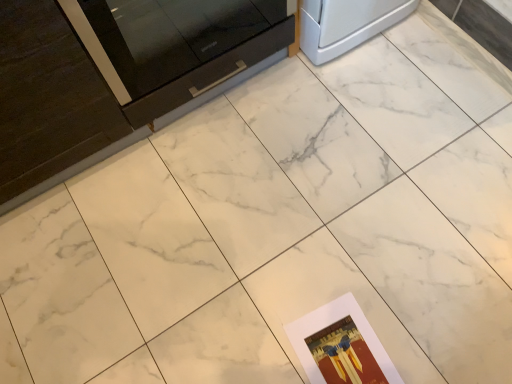
Locate an element on the screen. matte paper postcard at lower right is located at coordinates (341, 346).

The image size is (512, 384). What do you see at coordinates (341, 346) in the screenshot?
I see `matte paper postcard at lower right` at bounding box center [341, 346].

Locate an element on the screen. This screenshot has height=384, width=512. glossy black drawer at upper left is located at coordinates (210, 74).

What do you see at coordinates (210, 74) in the screenshot?
I see `glossy black drawer at upper left` at bounding box center [210, 74].

The image size is (512, 384). What are the coordinates of `matte paper postcard at lower right` in the screenshot? It's located at click(x=341, y=346).

Between matte paper postcard at lower right and glossy black drawer at upper left, which one appears on the right side from the viewer's perspective?

matte paper postcard at lower right is more to the right.

Considering their positions, is matte paper postcard at lower right located in front of or behind glossy black drawer at upper left?

matte paper postcard at lower right is behind glossy black drawer at upper left.

Is point (331, 321) in front of point (164, 96)?

That is True.

From the image's perspective, which is above, matte paper postcard at lower right or glossy black drawer at upper left?

glossy black drawer at upper left is shown above in the image.

From a real-world perspective, which object stands above the other?

glossy black drawer at upper left is physically above.

Consider the image. Looking at their sizes, would you say matte paper postcard at lower right is wider or thinner than glossy black drawer at upper left?

In the image, matte paper postcard at lower right appears to be wider than glossy black drawer at upper left.

Is matte paper postcard at lower right taller than glossy black drawer at upper left?

Incorrect, the height of matte paper postcard at lower right is not larger of that of glossy black drawer at upper left.

Which of these two, matte paper postcard at lower right or glossy black drawer at upper left, is smaller?

Smaller between the two is matte paper postcard at lower right.

Would you say matte paper postcard at lower right is outside glossy black drawer at upper left?

Yes, matte paper postcard at lower right is not within glossy black drawer at upper left.

Would you say matte paper postcard at lower right is a long distance from glossy black drawer at upper left?

No, matte paper postcard at lower right is in close proximity to glossy black drawer at upper left.

Is glossy black drawer at upper left at the back of matte paper postcard at lower right?

No, glossy black drawer at upper left is not at the back of matte paper postcard at lower right.

What's the angular difference between matte paper postcard at lower right and glossy black drawer at upper left's facing directions?

173 degrees separate the facing orientations of matte paper postcard at lower right and glossy black drawer at upper left.

Measure the distance between matte paper postcard at lower right and glossy black drawer at upper left.

31.89 inches.

At what (x,y) coordinates should I click in order to perform the action: click on drawer in front of the matte paper postcard at lower right. Please return your answer as a coordinate pair (x, y). Looking at the image, I should click on (210, 74).

Which is more to the right, glossy black drawer at upper left or matte paper postcard at lower right?

Positioned to the right is matte paper postcard at lower right.

In the scene shown: Which is in front, glossy black drawer at upper left or matte paper postcard at lower right?

glossy black drawer at upper left is closer to the camera.

Considering the points (277, 31) and (327, 319), which point is in front, point (277, 31) or point (327, 319)?

The point (327, 319) is more forward.

From the image's perspective, who appears lower, glossy black drawer at upper left or matte paper postcard at lower right?

matte paper postcard at lower right appears lower in the image.

From a real-world perspective, does glossy black drawer at upper left sit lower than matte paper postcard at lower right?

Actually, glossy black drawer at upper left is physically above matte paper postcard at lower right in the real world.

Does glossy black drawer at upper left have a greater width compared to matte paper postcard at lower right?

Incorrect, the width of glossy black drawer at upper left does not surpass that of matte paper postcard at lower right.

Considering the sizes of glossy black drawer at upper left and matte paper postcard at lower right in the image, is glossy black drawer at upper left taller or shorter than matte paper postcard at lower right?

Considering their sizes, glossy black drawer at upper left has more height than matte paper postcard at lower right.

Which of these two, glossy black drawer at upper left or matte paper postcard at lower right, is bigger?

glossy black drawer at upper left.

Could matte paper postcard at lower right be considered to be inside glossy black drawer at upper left?

Definitely not — matte paper postcard at lower right is not inside glossy black drawer at upper left.

Is glossy black drawer at upper left positioned far away from matte paper postcard at lower right?

Actually, glossy black drawer at upper left and matte paper postcard at lower right are a little close together.

Is glossy black drawer at upper left oriented towards matte paper postcard at lower right?

Yes, glossy black drawer at upper left is oriented towards matte paper postcard at lower right.

How many degrees apart are the facing directions of glossy black drawer at upper left and matte paper postcard at lower right?

glossy black drawer at upper left and matte paper postcard at lower right are facing 173 degrees away from each other.

Measure the distance from glossy black drawer at upper left to matte paper postcard at lower right.

glossy black drawer at upper left and matte paper postcard at lower right are 31.89 inches apart.

At what (x,y) coordinates should I click in order to perform the action: click on drawer that appears on the left of matte paper postcard at lower right. Please return your answer as a coordinate pair (x, y). The width and height of the screenshot is (512, 384). Looking at the image, I should click on (210, 74).

I want to click on drawer in front of the matte paper postcard at lower right, so click(210, 74).

Where is `drawer above the matte paper postcard at lower right (from the image's perspective)`? Image resolution: width=512 pixels, height=384 pixels. drawer above the matte paper postcard at lower right (from the image's perspective) is located at coordinates (210, 74).